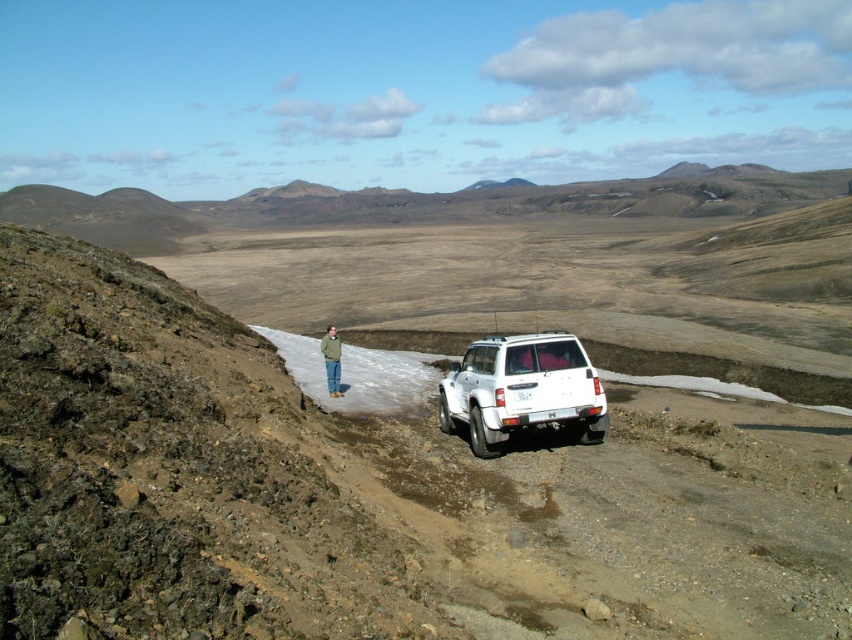
You are a hiker trying to decide whether to take your green fabric jacket at center with you on a short hike from the white matte suv at center. Considering their sizes, will the jacket fit into the trunk of the SUV?

The white matte suv at center has a lesser height compared to green fabric jacket at center. Since the jacket is taller than the SUV, it might not fit inside the trunk unless folded.

You are a hiker trying to reach the snow patch. You see the white matte suv at center and the green fabric jacket at center. Which object is closer to you?

The white matte suv at center is closer to you because it is in front of the green fabric jacket at center.